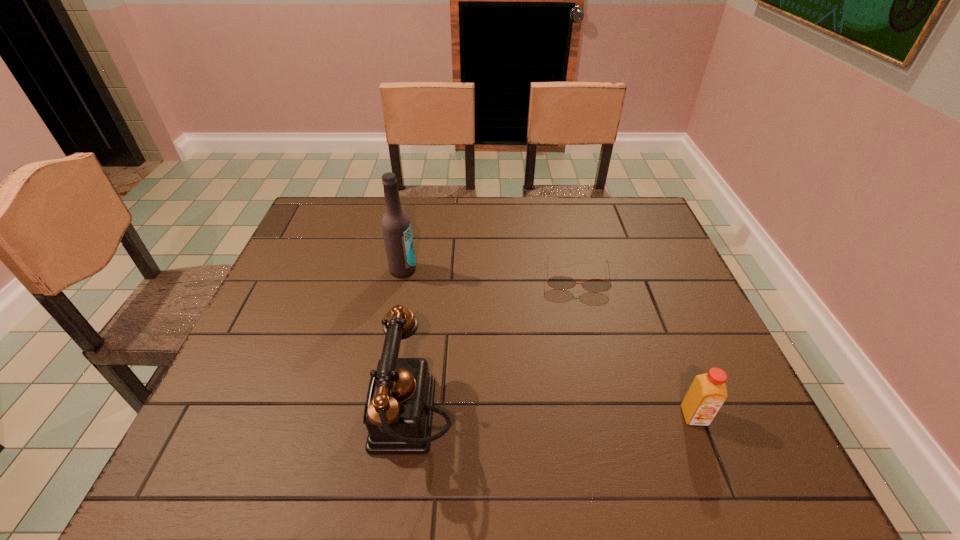
Identify the location of free point between the telephone and the shortest object. The height and width of the screenshot is (540, 960). (493, 347).

Image resolution: width=960 pixels, height=540 pixels. Identify the location of vacant space in between the orange juice and the third shortest object. (552, 417).

Locate an element on the screen. This screenshot has height=540, width=960. free spot between the third shortest object and the tallest object is located at coordinates (407, 345).

Where is `free area in between the third shortest object and the second shortest object`? This screenshot has width=960, height=540. free area in between the third shortest object and the second shortest object is located at coordinates (552, 417).

Identify the location of the closest object to the third shortest object. The height and width of the screenshot is (540, 960). (396, 227).

At what (x,y) coordinates should I click in order to perform the action: click on object that can be found as the second closest to the beer bottle. Please return your answer as a coordinate pair (x, y). Image resolution: width=960 pixels, height=540 pixels. Looking at the image, I should click on (558, 282).